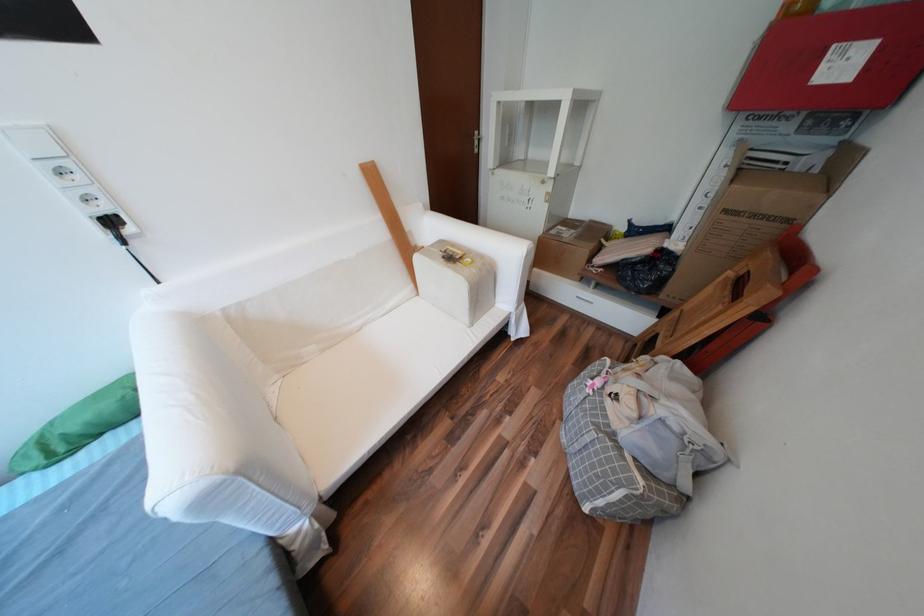
This screenshot has height=616, width=924. What do you see at coordinates (344, 400) in the screenshot?
I see `the sofa sitting surface` at bounding box center [344, 400].